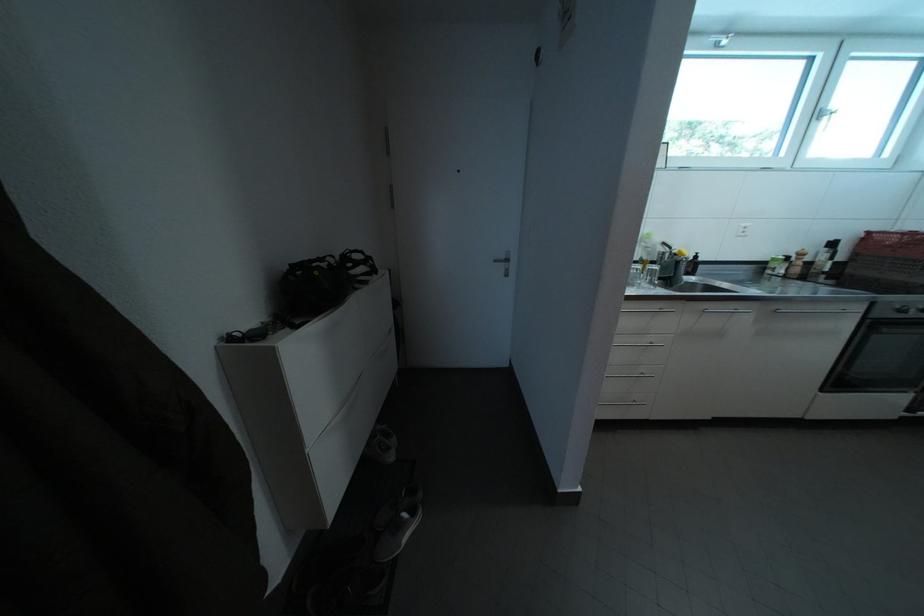
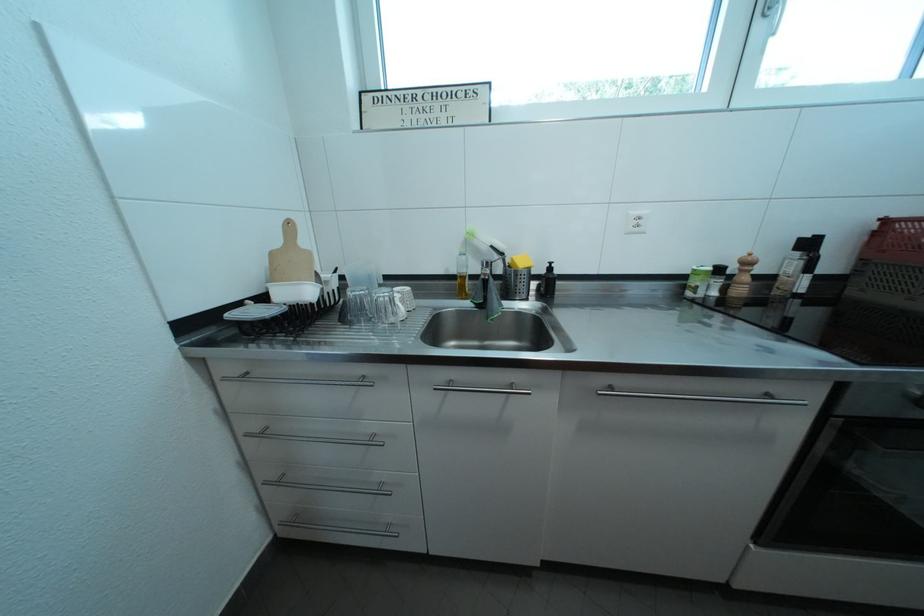
The images are taken continuously from a first-person perspective. In which direction are you moving?

The cameraman moved toward right, forward.